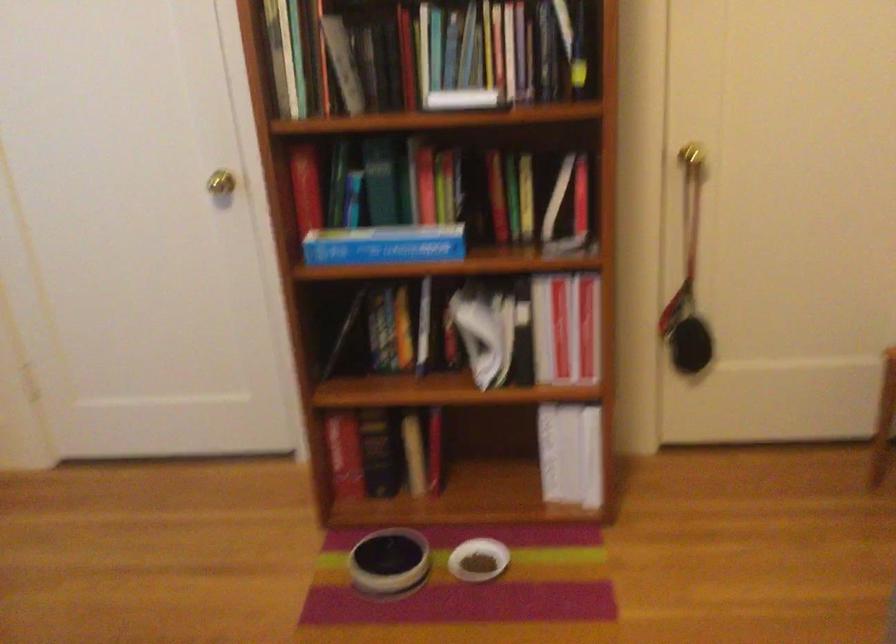
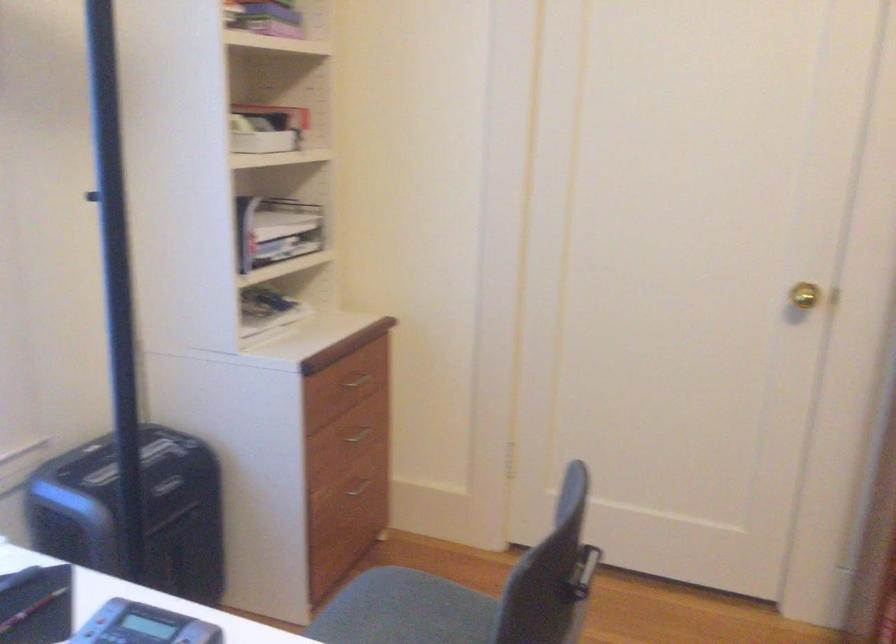
Where in the second image is the point corresponding to (211,180) from the first image?

(804, 295)